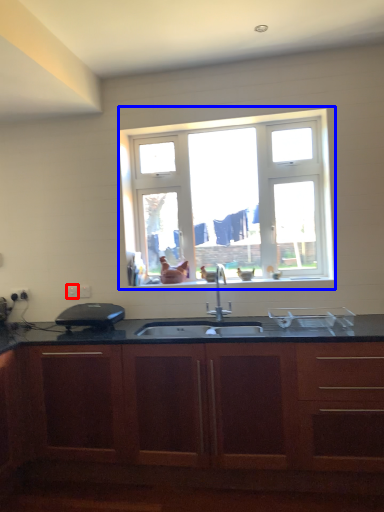
Question: Which point is closer to the camera, electric outlet (highlighted by a red box) or window (highlighted by a blue box)?

Choices:
 (A) electric outlet
 (B) window

Answer: (B)